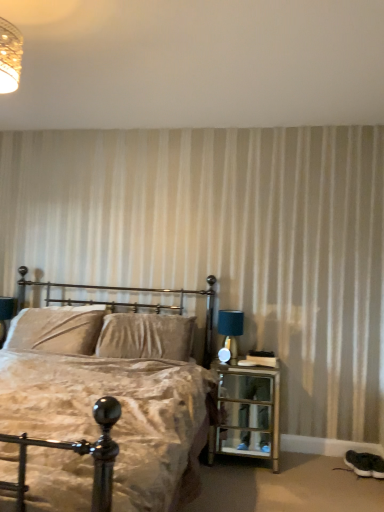
Question: In terms of width, does blue fabric table lamp at right look wider or thinner when compared to white textured wall at upper center?

Choices:
 (A) wide
 (B) thin

Answer: (B)

Question: Is blue fabric table lamp at right spatially inside white textured wall at upper center, or outside of it?

Choices:
 (A) outside
 (B) inside

Answer: (A)

Question: Estimate the real-world distances between objects in this image. Which object is closer to the velvet beige bed at center?

Choices:
 (A) blue fabric table lamp at right
 (B) velvet beige pillow at center, which is the second pillow from left to right
 (C) white textured wall at upper center
 (D) clear glass nightstand at right
 (E) velvet beige pillow at center, the 1th pillow viewed from the left

Answer: (B)

Question: Estimate the real-world distances between objects in this image. Which object is closer to the velvet beige bed at center?

Choices:
 (A) velvet beige pillow at center, marked as the 2th pillow in a right-to-left arrangement
 (B) velvet beige pillow at center, which is the second pillow from left to right
 (C) blue fabric table lamp at right
 (D) white textured wall at upper center
 (E) clear glass nightstand at right

Answer: (B)